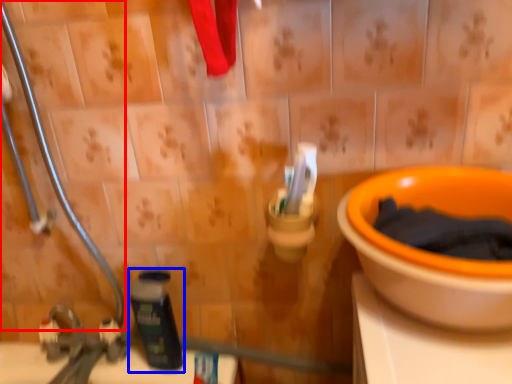
Question: Which of the following is the farthest to the observer, pipe (highlighted by a red box) or bottle (highlighted by a blue box)?

Choices:
 (A) pipe
 (B) bottle

Answer: (B)